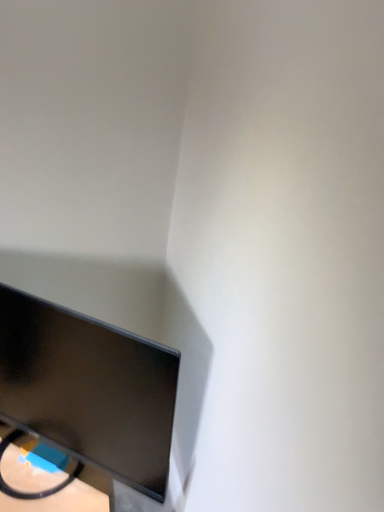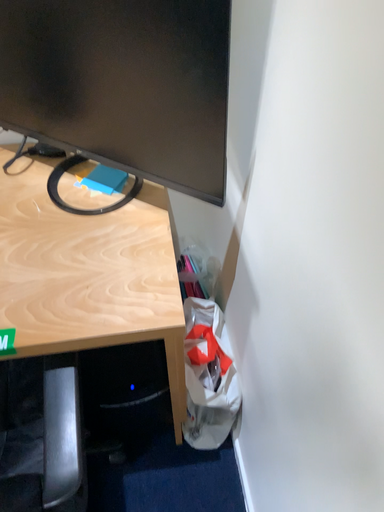
Question: How did the camera likely rotate when shooting the video?

Choices:
 (A) rotated left
 (B) rotated right

Answer: (A)